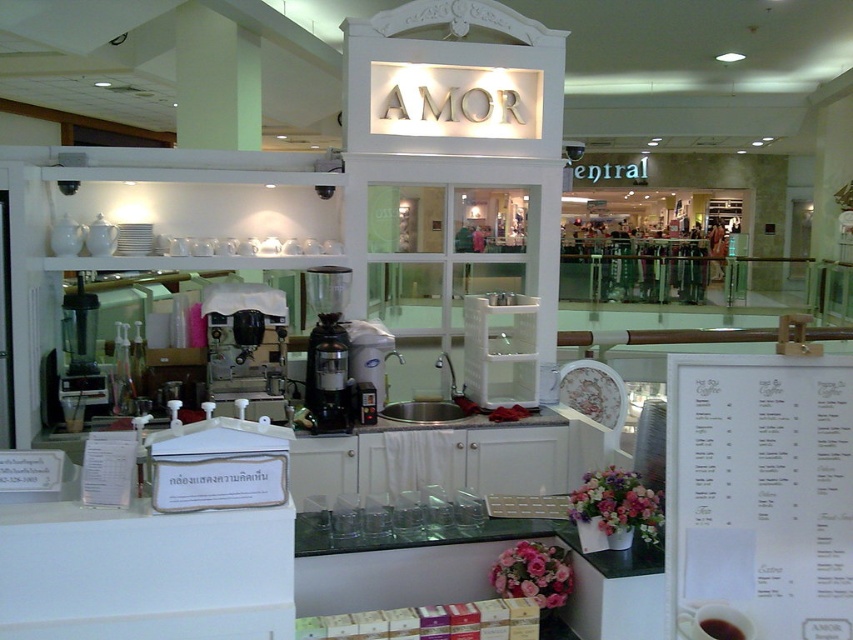
You are a barista working at the AMOR cafe. You need to grind some coffee beans but realize the grinder is out of reach. The black glossy cup at lower right is blocking your path. Can you move the cup to access the black matte coffee grinder at center?

The black matte coffee grinder at center is further to the viewer than the black glossy cup at lower right, so the cup is closer to you. You can move the black glossy cup at lower right to access the grinder.

You are a customer standing at the counter of the AMOR cafe. You want to place an order for a coffee drink. Which object, the black matte coffee grinder at center or the matte black blender at left, is closer to you?

The black matte coffee grinder at center is closer to you because it is located below the matte black blender at left, meaning it is positioned lower on the counter and thus nearer to your standing position.